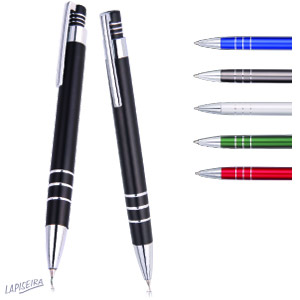
This screenshot has width=300, height=300. I want to click on pens placed vertically, so click(257, 42), click(258, 76), click(258, 107), click(258, 143), click(258, 169).